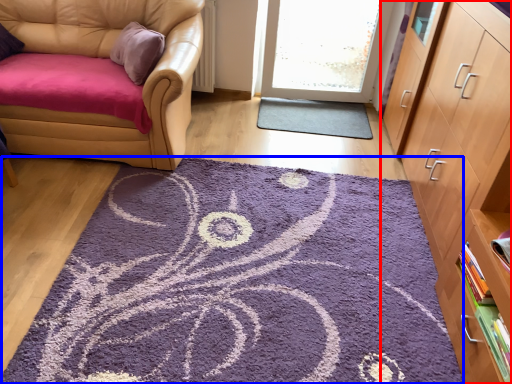
Question: Among these objects, which one is farthest to the camera, cabinetry (highlighted by a red box) or mat (highlighted by a blue box)?

Choices:
 (A) cabinetry
 (B) mat

Answer: (B)